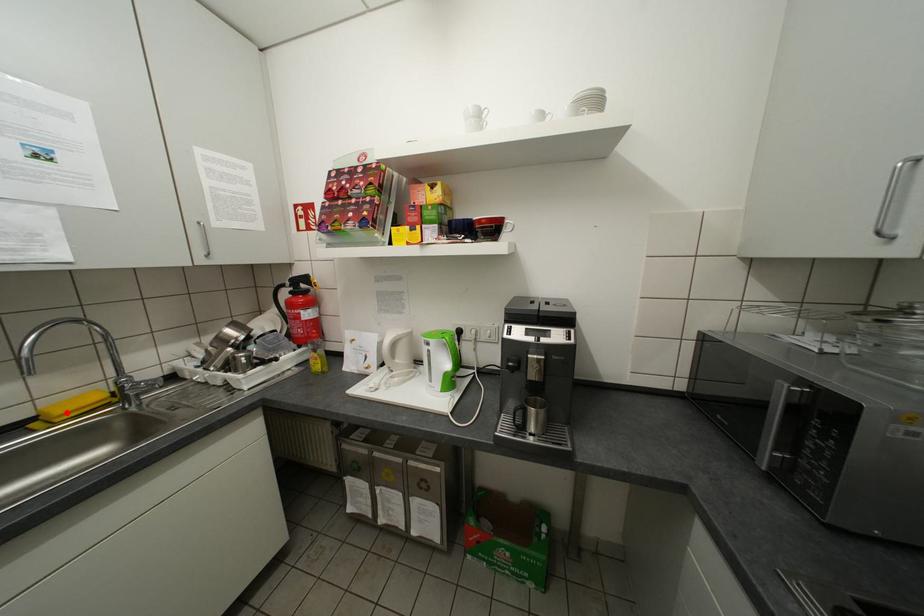
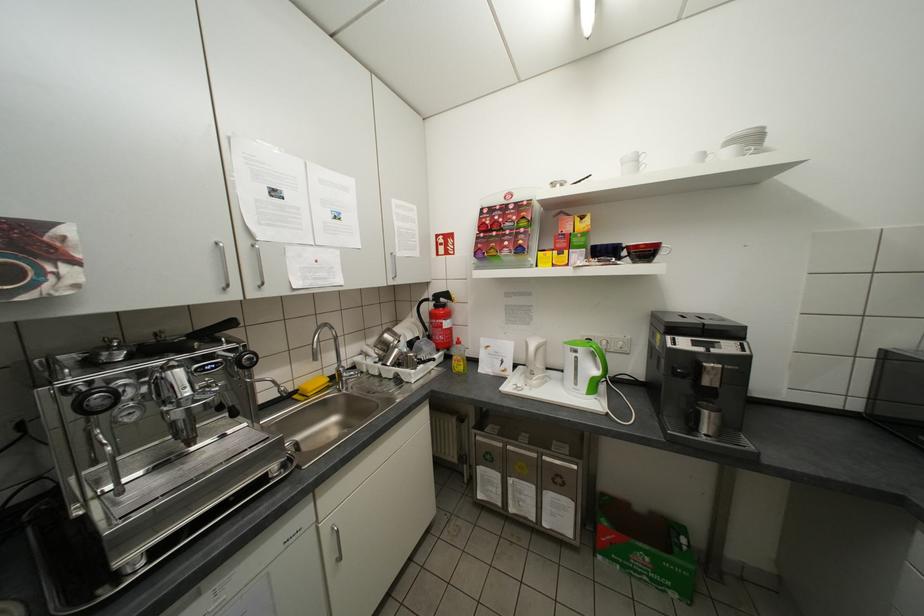
Find the pixel in the second image that matches the highlighted location in the first image.

(319, 389)